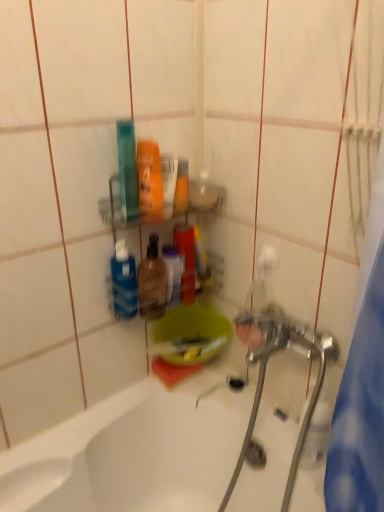
Locate an element on the screen. This screenshot has width=384, height=512. metallic silver water pipe at lower right is located at coordinates (305, 426).

The height and width of the screenshot is (512, 384). Describe the element at coordinates (265, 371) in the screenshot. I see `chrome metallic faucet at center` at that location.

Measure the distance between point (65, 502) and camera.

Point (65, 502) is 1.04 meters from camera.

This screenshot has height=512, width=384. Describe the element at coordinates (152, 282) in the screenshot. I see `translucent plastic bottle at center` at that location.

At what (x,y) coordinates should I click in order to perform the action: click on blue matte bottle at center. Please return your answer as a coordinate pair (x, y). Looking at the image, I should click on (124, 282).

Looking at this image, is metallic silver water pipe at lower right not near translucent plastic bottle at center?

No, metallic silver water pipe at lower right is not far away from translucent plastic bottle at center.

Is the position of metallic silver water pipe at lower right less distant than that of translucent plastic bottle at center?

Yes.

From the image's perspective, is metallic silver water pipe at lower right positioned above or below translucent plastic bottle at center?

Clearly, from the image's perspective, metallic silver water pipe at lower right is below translucent plastic bottle at center.

Is point (147, 304) closer or farther from the camera than point (303, 437)?

Point (147, 304) is farther from the camera than point (303, 437).

Is translucent plastic bottle at center facing towards metallic silver water pipe at lower right?

Yes, translucent plastic bottle at center is turned towards metallic silver water pipe at lower right.

In the scene shown: Could metallic silver water pipe at lower right be considered to be inside translucent plastic bottle at center?

No, translucent plastic bottle at center does not contain metallic silver water pipe at lower right.

How many degrees apart are the facing directions of translucent plastic bottle at center and metallic silver water pipe at lower right?

90 degrees separate the facing orientations of translucent plastic bottle at center and metallic silver water pipe at lower right.

Is metallic silver water pipe at lower right oriented away from white glossy bathtub at lower left?

That's not correct — metallic silver water pipe at lower right is not looking away from white glossy bathtub at lower left.

Is metallic silver water pipe at lower right to the left of white glossy bathtub at lower left from the viewer's perspective?

No, metallic silver water pipe at lower right is not to the left of white glossy bathtub at lower left.

Which of these two, metallic silver water pipe at lower right or white glossy bathtub at lower left, is wider?

white glossy bathtub at lower left.

From a real-world perspective, relative to white glossy bathtub at lower left, is metallic silver water pipe at lower right vertically above or below?

metallic silver water pipe at lower right is situated higher than white glossy bathtub at lower left in the real world.

Can you confirm if blue matte bottle at center is bigger than metallic silver water pipe at lower right?

Yes, blue matte bottle at center is bigger than metallic silver water pipe at lower right.

Which is further, (133, 258) or (319, 390)?

The point (133, 258) is more distant.

Is blue matte bottle at center behind metallic silver water pipe at lower right?

Yes, it is.

Which is correct: chrome metallic faucet at center is inside white glossy bathtub at lower left, or outside of it?

The correct answer is: inside.

Considering the relative sizes of chrome metallic faucet at center and white glossy bathtub at lower left in the image provided, is chrome metallic faucet at center thinner than white glossy bathtub at lower left?

Yes, chrome metallic faucet at center is thinner than white glossy bathtub at lower left.

Is chrome metallic faucet at center to the left or to the right of white glossy bathtub at lower left in the image?

chrome metallic faucet at center is positioned on white glossy bathtub at lower left's right side.

Consider the image. Considering the sizes of objects white glossy bathtub at lower left and translucent plastic bottle at center in the image provided, who is taller, white glossy bathtub at lower left or translucent plastic bottle at center?

white glossy bathtub at lower left.

From the image's perspective, which is above, white glossy bathtub at lower left or translucent plastic bottle at center?

From the image's view, translucent plastic bottle at center is above.

In the scene shown: Is the surface of white glossy bathtub at lower left in direct contact with translucent plastic bottle at center?

No.

Is white glossy bathtub at lower left looking in the opposite direction of translucent plastic bottle at center?

No, translucent plastic bottle at center is not at the back of white glossy bathtub at lower left.

Does translucent plastic bottle at center have a greater height compared to white glossy bathtub at lower left?

Incorrect, the height of translucent plastic bottle at center is not larger of that of white glossy bathtub at lower left.

Does translucent plastic bottle at center have a greater width compared to white glossy bathtub at lower left?

In fact, translucent plastic bottle at center might be narrower than white glossy bathtub at lower left.

Can you tell me how much translucent plastic bottle at center and white glossy bathtub at lower left differ in facing direction?

There is a 0.000885-degree angle between the facing directions of translucent plastic bottle at center and white glossy bathtub at lower left.

From a real-world perspective, who is located higher, translucent plastic bottle at center or white glossy bathtub at lower left?

From a 3D spatial view, translucent plastic bottle at center is above.

Where is `water pipe in front of the translucent plastic bottle at center`? This screenshot has width=384, height=512. water pipe in front of the translucent plastic bottle at center is located at coordinates (305, 426).

Image resolution: width=384 pixels, height=512 pixels. Identify the location of water pipe directly beneath the translucent plastic bottle at center (from a real-world perspective). (305, 426).

Based on their spatial positions, is blue matte bottle at center or metallic silver water pipe at lower right closer to chrome metallic faucet at center?

Among the two, metallic silver water pipe at lower right is located nearer to chrome metallic faucet at center.

Based on their spatial positions, is white glossy bathtub at lower left or chrome metallic faucet at center closer to translucent plastic bottle at center?

Among the two, chrome metallic faucet at center is located nearer to translucent plastic bottle at center.

Looking at the image, which one is located further to blue matte bottle at center, translucent plastic bottle at center or chrome metallic faucet at center?

Based on the image, chrome metallic faucet at center appears to be further to blue matte bottle at center.

Looking at the image, which one is located closer to white glossy bathtub at lower left, translucent plastic bottle at center or blue matte bottle at center?

translucent plastic bottle at center lies closer to white glossy bathtub at lower left than the other object.

When comparing their distances from white glossy bathtub at lower left, does chrome metallic faucet at center or blue matte bottle at center seem closer?

chrome metallic faucet at center lies closer to white glossy bathtub at lower left than the other object.

From the image, which object appears to be farther from metallic silver water pipe at lower right, translucent plastic bottle at center or white glossy bathtub at lower left?

translucent plastic bottle at center is positioned further to the anchor metallic silver water pipe at lower right.

Which object lies further to the anchor point blue matte bottle at center, metallic silver water pipe at lower right or white glossy bathtub at lower left?

Among the two, metallic silver water pipe at lower right is located further to blue matte bottle at center.

Which object lies nearer to the anchor point blue matte bottle at center, white glossy bathtub at lower left or translucent plastic bottle at center?

translucent plastic bottle at center is positioned closer to the anchor blue matte bottle at center.

Locate an element on the screen. The height and width of the screenshot is (512, 384). mouthwash between blue matte bottle at center and metallic silver water pipe at lower right is located at coordinates click(x=152, y=282).

This screenshot has width=384, height=512. I want to click on plumbing fixture located between white glossy bathtub at lower left and metallic silver water pipe at lower right in the left-right direction, so [265, 371].

I want to click on plumbing fixture between blue matte bottle at center and white glossy bathtub at lower left from top to bottom, so click(265, 371).

In order to click on plumbing fixture situated between blue matte bottle at center and metallic silver water pipe at lower right from left to right in this screenshot , I will do `click(265, 371)`.